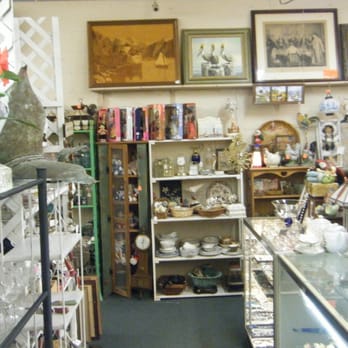
Where is `glass case`? The height and width of the screenshot is (348, 348). glass case is located at coordinates (315, 321).